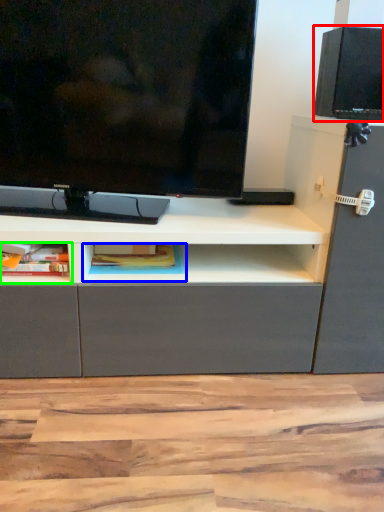
Question: Based on their relative distances, which object is nearer to speaker (highlighted by a red box)? Choose from cabinet (highlighted by a blue box) and cabinet (highlighted by a green box).

Choices:
 (A) cabinet
 (B) cabinet

Answer: (A)